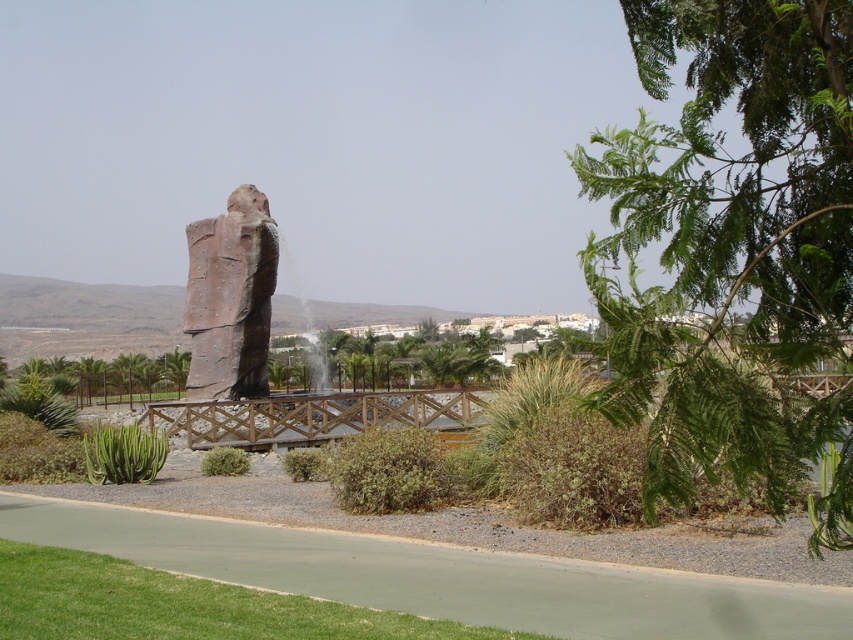
Question: Which point is farther to the camera?

Choices:
 (A) (53, 372)
 (B) (793, 125)
 (C) (146, 449)
 (D) (241, 220)

Answer: (A)

Question: Estimate the real-world distances between objects in this image. Which object is farther from the brown wooden bridge at center?

Choices:
 (A) green leafy tree at center
 (B) green succulent at lower left
 (C) rustic stone statue at center
 (D) green leafy tree at upper right

Answer: (A)

Question: Can you confirm if rustic stone statue at center is wider than green succulent at lower left?

Choices:
 (A) no
 (B) yes

Answer: (B)

Question: In this image, where is green leafy tree at upper right located relative to green succulent at lower left?

Choices:
 (A) left
 (B) right

Answer: (B)

Question: Is rustic stone statue at center below green leafy tree at center?

Choices:
 (A) no
 (B) yes

Answer: (A)

Question: Which object is the farthest from the brown wooden bridge at center?

Choices:
 (A) green leafy tree at upper right
 (B) rustic stone statue at center
 (C) green succulent at lower left

Answer: (B)